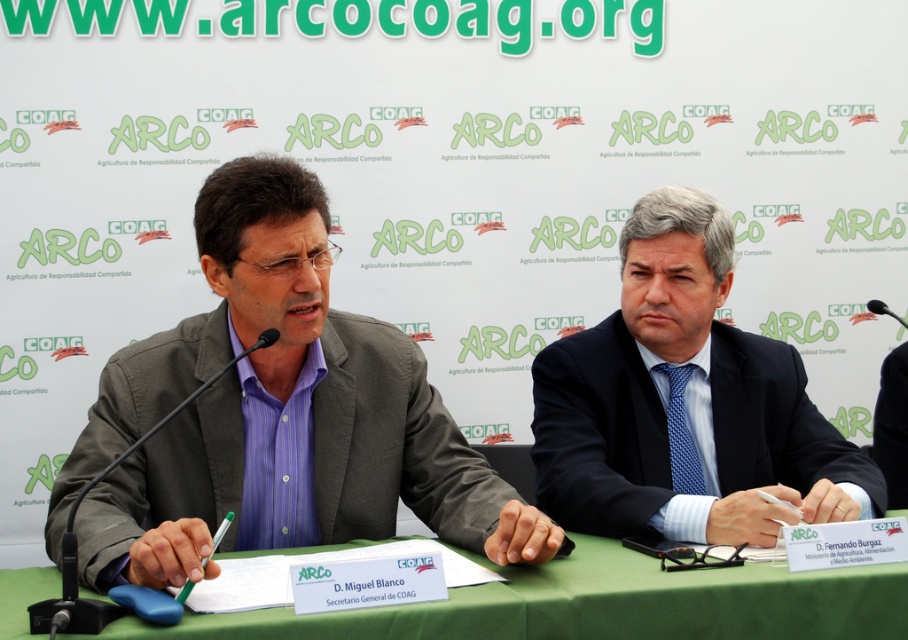
Question: Can you confirm if black plastic microphone at left is positioned below black plastic microphone at center?

Choices:
 (A) no
 (B) yes

Answer: (B)

Question: Which point is farther to the camera?

Choices:
 (A) (802, 428)
 (B) (904, 324)
 (C) (716, 572)

Answer: (B)

Question: Which object is positioned closest to the green fabric table at center?

Choices:
 (A) matte gray suit at center
 (B) black plastic microphone at center

Answer: (A)

Question: In this image, where is dark blue suit at center located relative to green fabric table at center?

Choices:
 (A) right
 (B) left

Answer: (A)

Question: Does matte gray suit at center appear over black plastic microphone at left?

Choices:
 (A) no
 (B) yes

Answer: (B)

Question: Which object is the farthest from the green fabric table at center?

Choices:
 (A) black plastic microphone at left
 (B) dark blue suit at center
 (C) matte gray suit at center
 (D) black plastic microphone at center

Answer: (D)